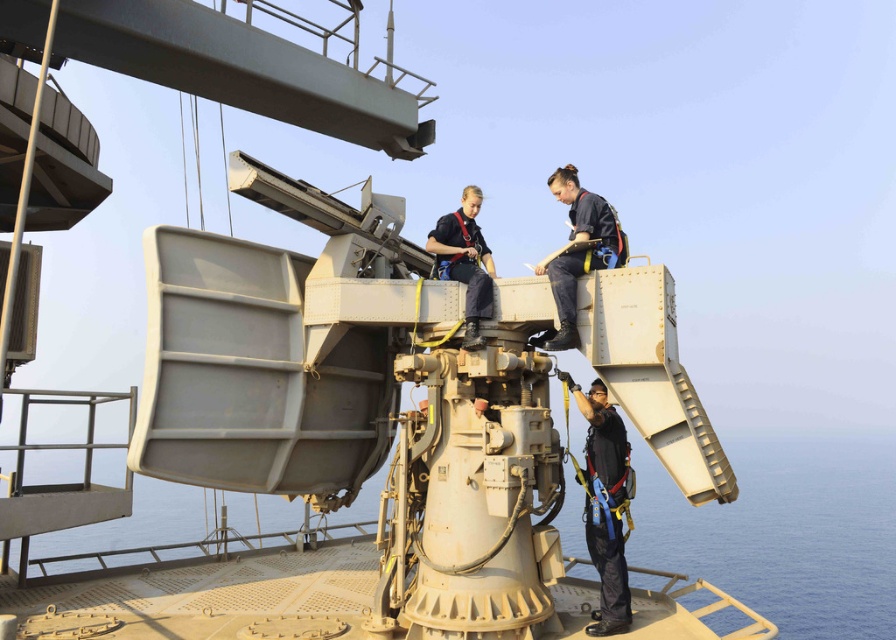
Who is higher up, smooth tan water at lower center or dark blue uniform at upper right?

dark blue uniform at upper right

From the picture: Is smooth tan water at lower center closer to the viewer compared to dark blue uniform at upper right?

No, it is behind dark blue uniform at upper right.

Is point (869, 497) farther from viewer compared to point (605, 266)?

That is True.

At what (x,y) coordinates should I click in order to perform the action: click on smooth tan water at lower center. Please return your answer as a coordinate pair (x, y). Image resolution: width=896 pixels, height=640 pixels. Looking at the image, I should click on (786, 531).

Between black fabric harness at center and dark blue uniform at center, which one appears on the left side from the viewer's perspective?

Positioned to the left is dark blue uniform at center.

Measure the distance between black fabric harness at center and camera.

12.73 feet

Image resolution: width=896 pixels, height=640 pixels. I want to click on black fabric harness at center, so click(605, 506).

Does dark blue uniform at upper right have a lesser width compared to dark blue uniform at center?

No, dark blue uniform at upper right is not thinner than dark blue uniform at center.

Is dark blue uniform at upper right positioned in front of dark blue uniform at center?

Yes, it is.

The width and height of the screenshot is (896, 640). Describe the element at coordinates (578, 250) in the screenshot. I see `dark blue uniform at upper right` at that location.

This screenshot has height=640, width=896. What are the coordinates of `dark blue uniform at upper right` in the screenshot? It's located at (578, 250).